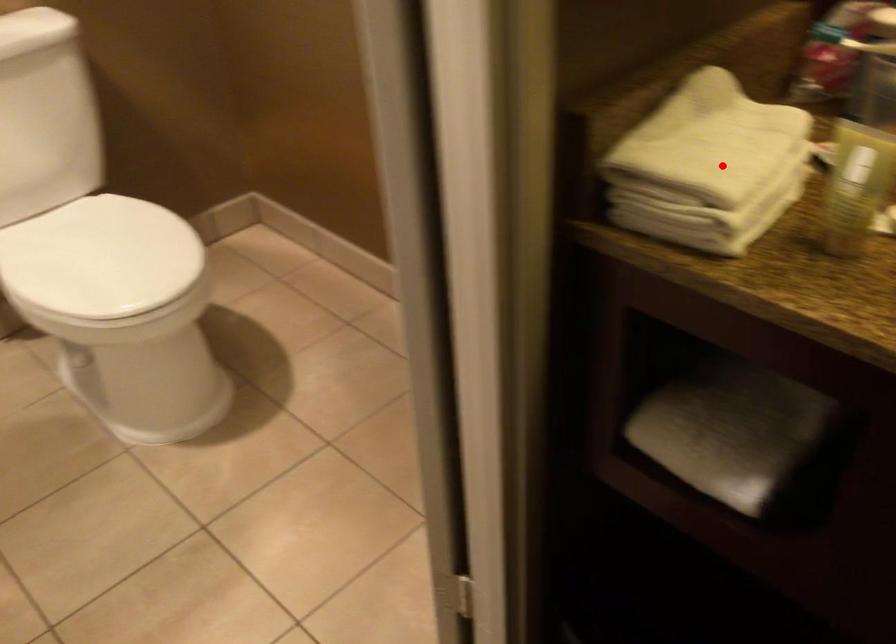
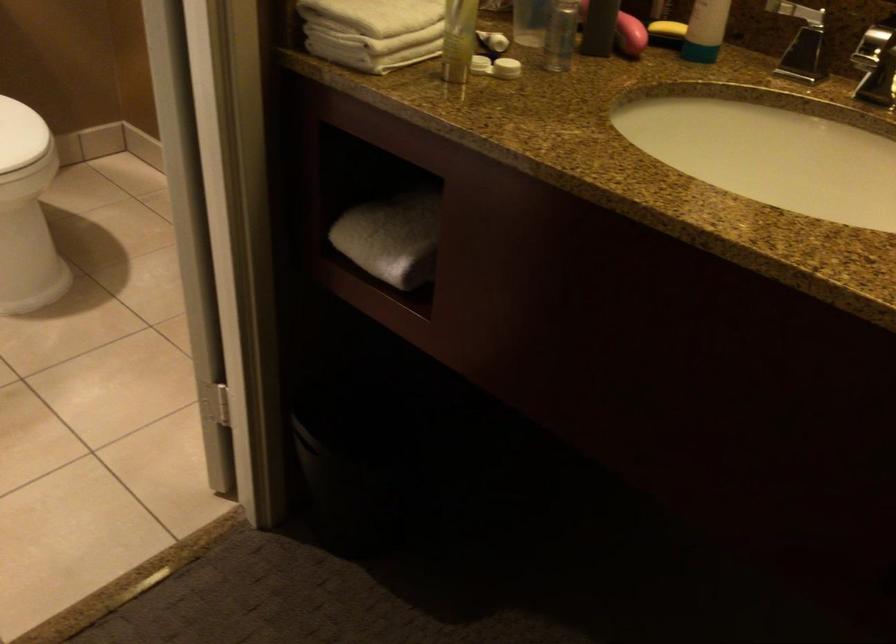
Question: I am providing you with two images of the same scene from different viewpoints. A red point is shown in image1. For the corresponding object point in image2, is it positioned nearer or farther from the camera?

Choices:
 (A) Nearer
 (B) Farther

Answer: (B)